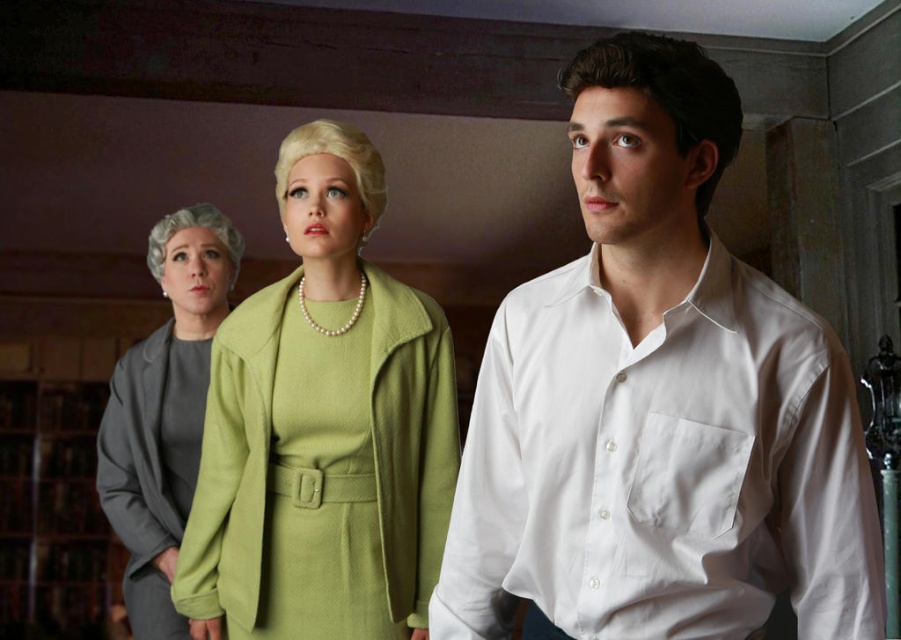
Consider the image. You are a tailor measuring garments for display in a boutique. You have two items to hang on a rack that can only accommodate items up to the height of the matte green dress at center. Can the white cotton shirt at center be displayed on this rack?

The white cotton shirt at center is not as tall as matte green dress at center, so it can be displayed on the rack since its height is within the allowed limit.

You are organizing a charity event and need to display two outfits on mannequins. The white cotton shirt at center and the gray wool suit at left are available. If you want to place them side by side in a narrow display area, which outfit would require less space?

The white cotton shirt at center occupies less space than the gray wool suit at left, so it would require less space in the narrow display area.